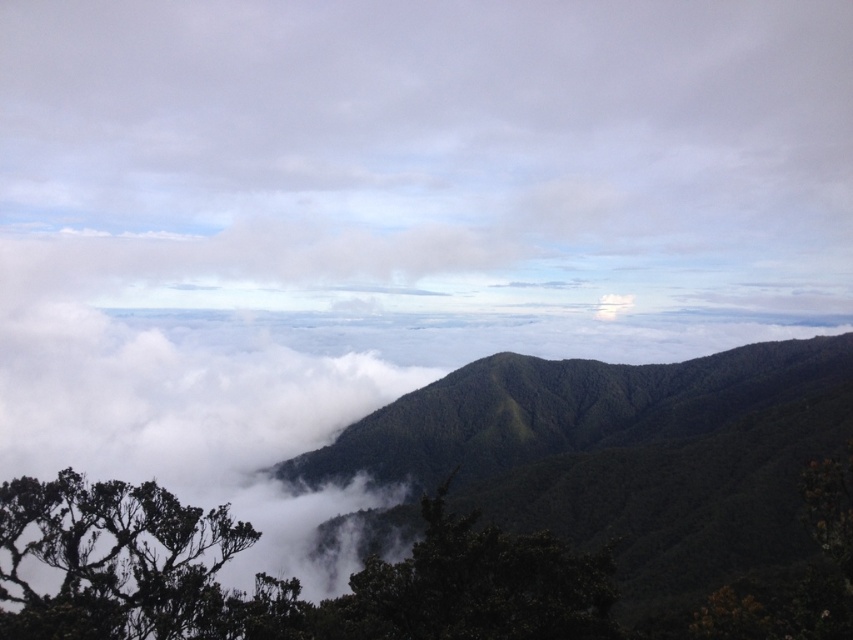
Question: Does dark green leafy tree at lower left appear over green leafy tree at center?

Choices:
 (A) no
 (B) yes

Answer: (B)

Question: Is dark green leafy tree at lower left above green leafy tree at center?

Choices:
 (A) no
 (B) yes

Answer: (B)

Question: Which object is positioned farthest from the dark green leafy tree at lower left?

Choices:
 (A) green leafy tree at center
 (B) green textured mountain at center

Answer: (B)

Question: Which is nearer to the green leafy tree at center?

Choices:
 (A) dark green leafy tree at lower left
 (B) green textured mountain at center

Answer: (A)

Question: Considering the relative positions of dark green leafy tree at lower left and green leafy tree at center in the image provided, where is dark green leafy tree at lower left located with respect to green leafy tree at center?

Choices:
 (A) left
 (B) right

Answer: (A)

Question: Which object appears closest to the camera in this image?

Choices:
 (A) green textured mountain at center
 (B) green leafy tree at center
 (C) dark green leafy tree at lower left

Answer: (C)